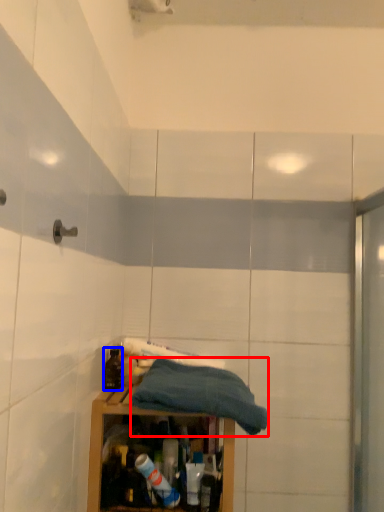
Question: Which object appears farthest to the camera in this image, towel (highlighted by a red box) or bottle (highlighted by a blue box)?

Choices:
 (A) towel
 (B) bottle

Answer: (B)